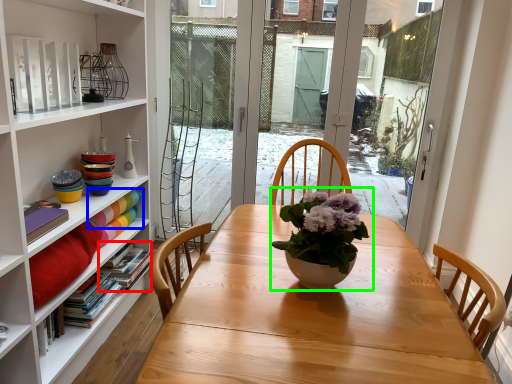
Question: Which object is positioned farthest from book (highlighted by a red box)? Select from book (highlighted by a blue box) and houseplant (highlighted by a green box).

Choices:
 (A) book
 (B) houseplant

Answer: (B)